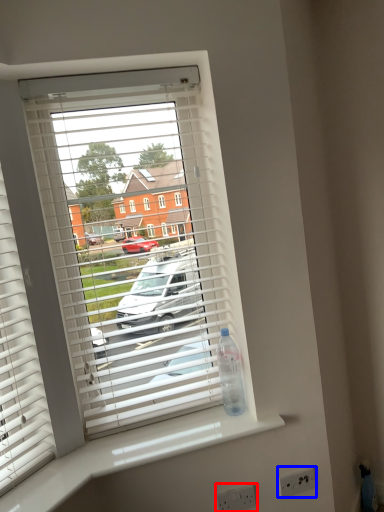
Question: Which object appears closest to the camera in this image, electric outlet (highlighted by a red box) or electric outlet (highlighted by a blue box)?

Choices:
 (A) electric outlet
 (B) electric outlet

Answer: (A)